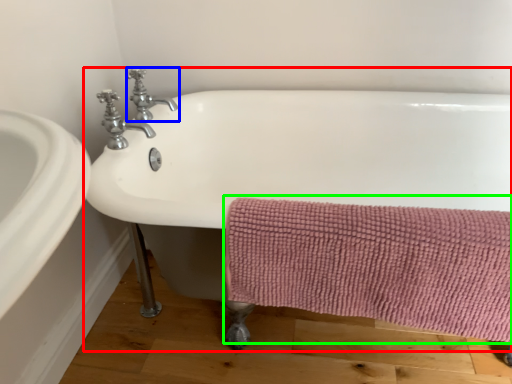
Question: Considering the real-world distances, which object is farthest from bathtub (highlighted by a red box)? tap (highlighted by a blue box) or bath towel (highlighted by a green box)?

Choices:
 (A) tap
 (B) bath towel

Answer: (A)